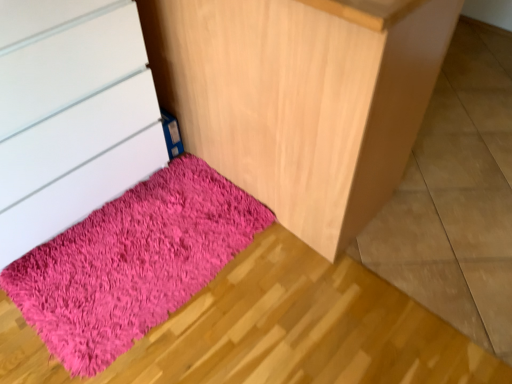
Question: In the image, is matte white chest of drawers at lower left positioned in front of or behind shaggy pink rug at lower left?

Choices:
 (A) behind
 (B) front

Answer: (B)

Question: Is matte white chest of drawers at lower left spatially inside shaggy pink rug at lower left, or outside of it?

Choices:
 (A) inside
 (B) outside

Answer: (B)

Question: Which object is positioned closest to the fuzzy pink rug at lower left?

Choices:
 (A) shaggy pink rug at lower left
 (B) matte white chest of drawers at lower left

Answer: (B)

Question: Estimate the real-world distances between objects in this image. Which object is closer to the fuzzy pink rug at lower left?

Choices:
 (A) shaggy pink rug at lower left
 (B) matte white chest of drawers at lower left

Answer: (B)